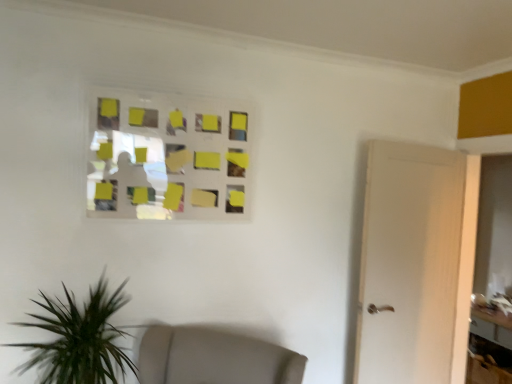
Question: Visually, is wooden table at lower right positioned to the left or to the right of yellow matte glass window at upper center?

Choices:
 (A) left
 (B) right

Answer: (B)

Question: From the image's perspective, is wooden table at lower right above or below yellow matte glass window at upper center?

Choices:
 (A) below
 (B) above

Answer: (A)

Question: From a real-world perspective, is wooden table at lower right physically located above or below yellow matte glass window at upper center?

Choices:
 (A) above
 (B) below

Answer: (B)

Question: Considering the positions of yellow matte glass window at upper center and wooden table at lower right in the image, is yellow matte glass window at upper center bigger or smaller than wooden table at lower right?

Choices:
 (A) small
 (B) big

Answer: (A)

Question: From their relative heights in the image, would you say yellow matte glass window at upper center is taller or shorter than wooden table at lower right?

Choices:
 (A) short
 (B) tall

Answer: (A)

Question: Relative to wooden table at lower right, is yellow matte glass window at upper center in front or behind?

Choices:
 (A) behind
 (B) front

Answer: (B)

Question: Is yellow matte glass window at upper center to the left or to the right of wooden table at lower right in the image?

Choices:
 (A) left
 (B) right

Answer: (A)